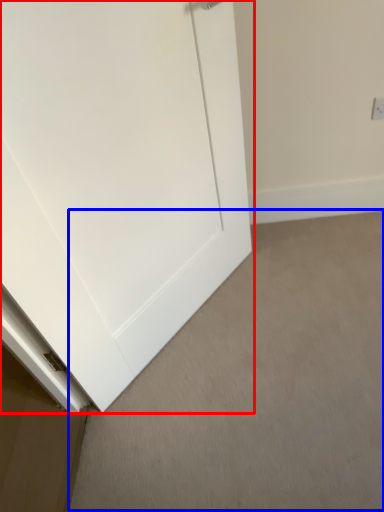
Question: Which object appears farthest to the camera in this image, door (highlighted by a red box) or plain (highlighted by a blue box)?

Choices:
 (A) door
 (B) plain

Answer: (B)